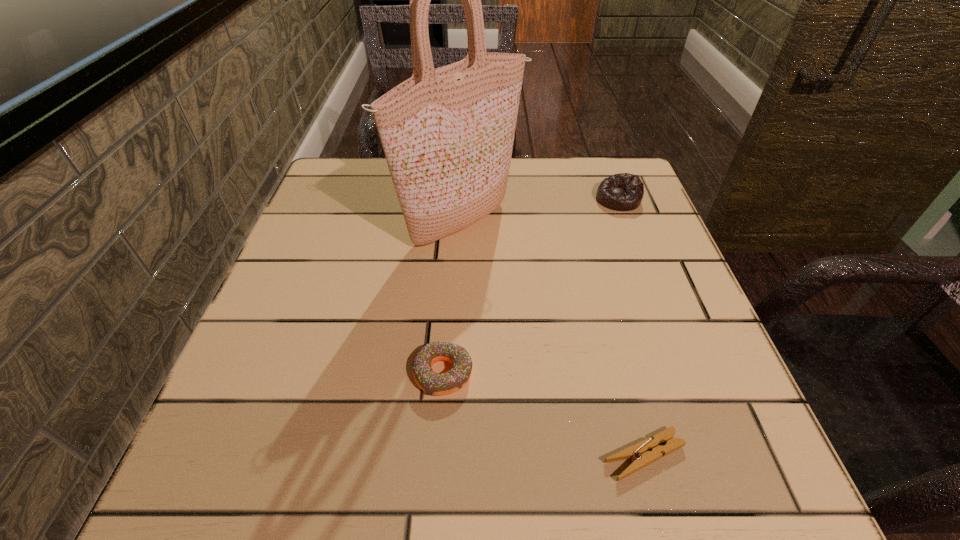
You are a GUI agent. You are given a task and a screenshot of the screen. Output one action in this format:
    pyautogui.click(x=<x>, y=<y>)
    Task: Click on the free space that is in between the third farthest object and the beanbag
    The height and width of the screenshot is (540, 960).
    Given the screenshot: What is the action you would take?
    pyautogui.click(x=530, y=286)

Locate an element on the screen. empty space that is in between the second shortest object and the second tallest object is located at coordinates (530, 286).

Identify which object is located as the third nearest to the clothespin. Please provide its 2D coordinates. Your answer should be formatted as a tuple, i.e. [(x, y)], where the tuple contains the x and y coordinates of a point satisfying the conditions above.

[(623, 192)]

This screenshot has height=540, width=960. In order to click on the third closest object to the beanbag in this screenshot , I will do `click(647, 451)`.

Find the location of a particular element. The width and height of the screenshot is (960, 540). vacant space that satisfies the following two spatial constraints: 1. on the back side of the doughnut; 2. on the left side of the shopping bag is located at coordinates (453, 223).

This screenshot has height=540, width=960. What are the coordinates of `vacant area in the image that satisfies the following two spatial constraints: 1. on the back side of the second nearest object; 2. on the right side of the beanbag` in the screenshot? It's located at (455, 199).